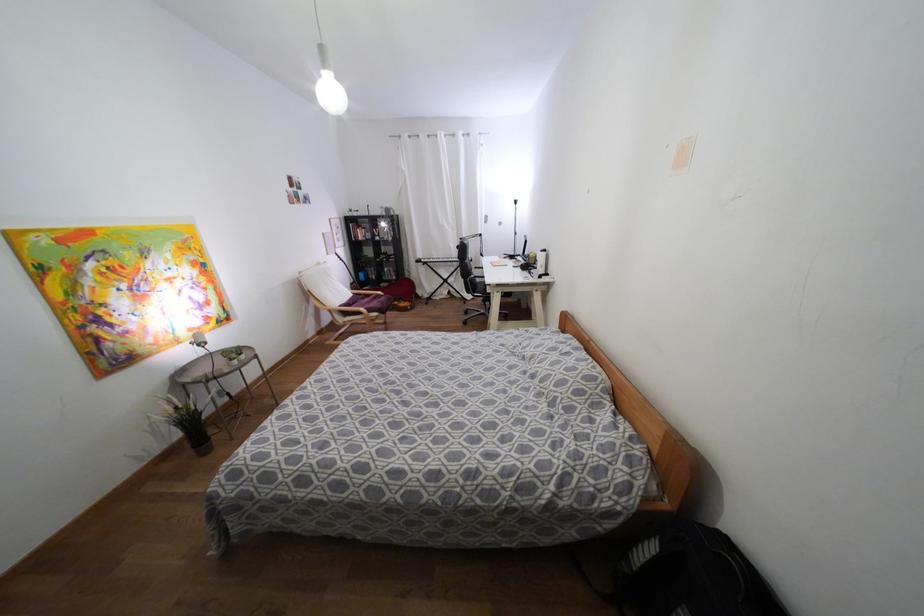
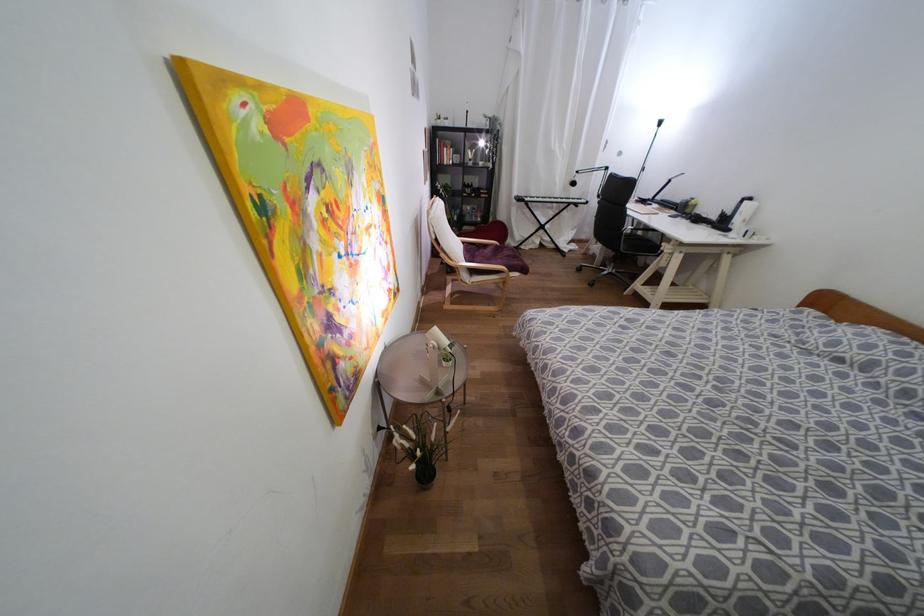
Find the pixel in the second image that matches point (359, 238) in the first image.

(444, 161)